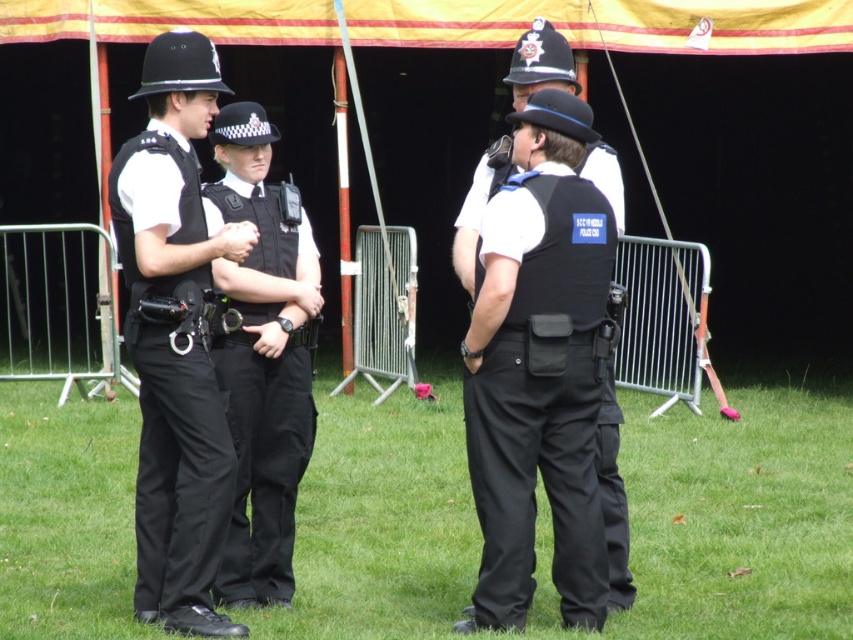
Question: Among these points, which one is farthest from the camera?

Choices:
 (A) (792, 392)
 (B) (605, 465)
 (C) (247, 19)

Answer: (A)

Question: Where is yellow fabric tent at center located in relation to black uniform at center in the image?

Choices:
 (A) left
 (B) right

Answer: (A)

Question: Which object is farther from the camera taking this photo?

Choices:
 (A) matte black uniform at center
 (B) yellow fabric tent at center
 (C) green grass at center

Answer: (B)

Question: Is green grass at center smaller than matte black uniform at center?

Choices:
 (A) yes
 (B) no

Answer: (A)

Question: Can you confirm if green grass at center is positioned below matte black uniform at center?

Choices:
 (A) no
 (B) yes

Answer: (B)

Question: Which point is farther to the camera?

Choices:
 (A) (235, 10)
 (B) (141, 582)
 (C) (502, 154)
 (D) (798, 20)

Answer: (D)